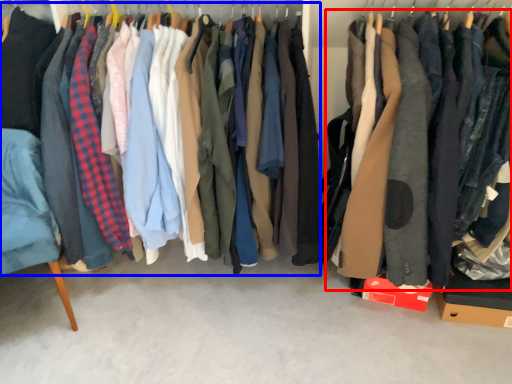
Question: Which of the following is the farthest to the observer, clothing (highlighted by a red box) or closet (highlighted by a blue box)?

Choices:
 (A) clothing
 (B) closet

Answer: (B)